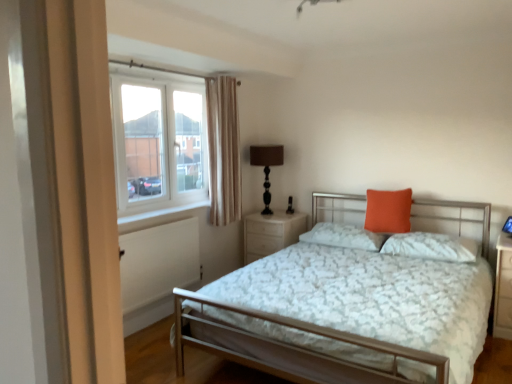
Describe the element at coordinates (162, 212) in the screenshot. The image size is (512, 384). I see `white painted wood at lower left` at that location.

Where is `white painted wood at lower left`? This screenshot has height=384, width=512. white painted wood at lower left is located at coordinates (162, 212).

Measure the distance between orange fabric pillow at center, the 1th pillow from the left, and camera.

orange fabric pillow at center, the 1th pillow from the left, is 11.26 feet away from camera.

Locate an element on the screen. orange matte pillow at upper right, which is the 2th pillow in left-to-right order is located at coordinates (388, 211).

Describe the element at coordinates (347, 313) in the screenshot. I see `metallic silver bed at center` at that location.

The width and height of the screenshot is (512, 384). I want to click on metallic silver bed at center, so click(347, 313).

This screenshot has height=384, width=512. What are the coordinates of `white textured pillow at center, which is counted as the first pillow, starting from the right` in the screenshot? It's located at (431, 246).

Locate an element on the screen. This screenshot has height=384, width=512. white painted wood at lower left is located at coordinates (162, 212).

How far apart are beige fabric curtain at upper left and orange fabric pillow at center, which appears as the third pillow when viewed from the right?

beige fabric curtain at upper left and orange fabric pillow at center, which appears as the third pillow when viewed from the right, are 3.70 feet apart.

Is beige fabric curtain at upper left taller than orange fabric pillow at center, the 1th pillow from the left?

Yes.

Is beige fabric curtain at upper left looking in the opposite direction of orange fabric pillow at center, the 1th pillow from the left?

That's not correct — beige fabric curtain at upper left is not looking away from orange fabric pillow at center, the 1th pillow from the left.

Is beige fabric curtain at upper left far from orange fabric pillow at center, which appears as the third pillow when viewed from the right?

That's right, there is a large distance between beige fabric curtain at upper left and orange fabric pillow at center, which appears as the third pillow when viewed from the right.

From a real-world perspective, is orange fabric pillow at center, the 1th pillow from the left, positioned under pine wood nightstand at center based on gravity?

No, from a real-world perspective, orange fabric pillow at center, the 1th pillow from the left, is not under pine wood nightstand at center.

Does orange fabric pillow at center, which appears as the third pillow when viewed from the right, turn towards pine wood nightstand at center?

No, orange fabric pillow at center, which appears as the third pillow when viewed from the right, does not turn towards pine wood nightstand at center.

Would you say orange fabric pillow at center, the 1th pillow from the left, is to the left or to the right of pine wood nightstand at center in the picture?

From the image, it's evident that orange fabric pillow at center, the 1th pillow from the left, is to the right of pine wood nightstand at center.

Relative to brown fabric-covered lamp at upper right, is white painted wood at lower left in front or behind?

white painted wood at lower left is in front of brown fabric-covered lamp at upper right.

From the image's perspective, which one is positioned higher, white painted wood at lower left or brown fabric-covered lamp at upper right?

brown fabric-covered lamp at upper right.

Which is farther, (170,212) or (253,155)?

The point (253,155) is farther.

Is white painted wood at lower left far from brown fabric-covered lamp at upper right?

That's not correct — white painted wood at lower left is a little close to brown fabric-covered lamp at upper right.

Between white textured pillow at center, marked as the 3th pillow in a left-to-right arrangement, and pine wood nightstand at center, which one appears on the right side from the viewer's perspective?

white textured pillow at center, marked as the 3th pillow in a left-to-right arrangement.

In terms of height, does white textured pillow at center, which is counted as the first pillow, starting from the right, look taller or shorter compared to pine wood nightstand at center?

Considering their sizes, white textured pillow at center, which is counted as the first pillow, starting from the right, has less height than pine wood nightstand at center.

At what (x,y) coordinates should I click in order to perform the action: click on the 1st pillow positioned above the pine wood nightstand at center (from the image's perspective). Please return your answer as a coordinate pair (x, y). This screenshot has height=384, width=512. Looking at the image, I should click on (431, 246).

From a real-world perspective, does white textured pillow at center, which is counted as the first pillow, starting from the right, sit lower than pine wood nightstand at center?

No, from a real-world perspective, white textured pillow at center, which is counted as the first pillow, starting from the right, is not under pine wood nightstand at center.

Is orange matte pillow at upper right, the second pillow when ordered from right to left, bigger than white textured pillow at center, which is counted as the first pillow, starting from the right?

No.

From the white textured pillow at center, which is counted as the first pillow, starting from the right, count 2nd pillows backward and point to it. Please provide its 2D coordinates.

[(388, 211)]

Is orange matte pillow at upper right, the second pillow when ordered from right to left, not close to white textured pillow at center, which is counted as the first pillow, starting from the right?

Actually, orange matte pillow at upper right, the second pillow when ordered from right to left, and white textured pillow at center, which is counted as the first pillow, starting from the right, are a little close together.

Is orange matte pillow at upper right, the second pillow when ordered from right to left, completely or partially outside of white textured pillow at center, marked as the 3th pillow in a left-to-right arrangement?

That's correct, orange matte pillow at upper right, the second pillow when ordered from right to left, is outside of white textured pillow at center, marked as the 3th pillow in a left-to-right arrangement.

Between orange matte pillow at upper right, which is the 2th pillow in left-to-right order, and clear glass window at upper left, which one appears on the right side from the viewer's perspective?

orange matte pillow at upper right, which is the 2th pillow in left-to-right order.

Does orange matte pillow at upper right, the second pillow when ordered from right to left, contain clear glass window at upper left?

No.

At what (x,y) coordinates should I click in order to perform the action: click on window above the orange matte pillow at upper right, which is the 2th pillow in left-to-right order (from the image's perspective). Please return your answer as a coordinate pair (x, y). Looking at the image, I should click on (158, 140).

Are orange matte pillow at upper right, which is the 2th pillow in left-to-right order, and clear glass window at upper left beside each other?

No, orange matte pillow at upper right, which is the 2th pillow in left-to-right order, is not touching clear glass window at upper left.

From the image's perspective, which is below, metallic silver bed at center or white painted wood at lower left?

metallic silver bed at center.

In the image, is metallic silver bed at center on the left side or the right side of white painted wood at lower left?

Clearly, metallic silver bed at center is on the right of white painted wood at lower left in the image.

Based on the photo, is white painted wood at lower left at the back of metallic silver bed at center?

No, metallic silver bed at center's orientation is not away from white painted wood at lower left.

Does metallic silver bed at center have a greater height compared to white painted wood at lower left?

Yes, metallic silver bed at center is taller than white painted wood at lower left.

Locate an element on the screen. The image size is (512, 384). curtain above the orange fabric pillow at center, the 1th pillow from the left (from a real-world perspective) is located at coordinates (223, 150).

You are a GUI agent. You are given a task and a screenshot of the screen. Output one action in this format:
    pyautogui.click(x=<x>, y=<y>)
    Task: Click on the nightstand below the orange fabric pillow at center, the 1th pillow from the left (from the image's perspective)
    
    Given the screenshot: What is the action you would take?
    pyautogui.click(x=271, y=233)

In the scene shown: From the image, which object appears to be farther from orange matte pillow at upper right, the second pillow when ordered from right to left, metallic silver bed at center or clear glass window at upper left?

Based on the image, clear glass window at upper left appears to be further to orange matte pillow at upper right, the second pillow when ordered from right to left.

Considering their positions, is orange matte pillow at upper right, which is the 2th pillow in left-to-right order, positioned further to pine wood nightstand at center than beige fabric curtain at upper left?

The object further to pine wood nightstand at center is orange matte pillow at upper right, which is the 2th pillow in left-to-right order.

When comparing their distances from white painted wood at lower left, does clear glass window at upper left or pine wood nightstand at center seem closer?

clear glass window at upper left.

From the image, which object appears to be nearer to beige fabric curtain at upper left, white textured pillow at center, marked as the 3th pillow in a left-to-right arrangement, or white painted wood at lower left?

white painted wood at lower left is closer to beige fabric curtain at upper left.

From the image, which object appears to be farther from white painted wood at lower left, white textured pillow at center, which is counted as the first pillow, starting from the right, or orange matte pillow at upper right, which is the 2th pillow in left-to-right order?

Among the two, white textured pillow at center, which is counted as the first pillow, starting from the right, is located further to white painted wood at lower left.

When comparing their distances from white textured pillow at center, which is counted as the first pillow, starting from the right, does orange matte pillow at upper right, which is the 2th pillow in left-to-right order, or metallic silver bed at center seem further?

Among the two, metallic silver bed at center is located further to white textured pillow at center, which is counted as the first pillow, starting from the right.

Estimate the real-world distances between objects in this image. Which object is closer to beige fabric curtain at upper left, metallic silver bed at center or orange matte pillow at upper right, which is the 2th pillow in left-to-right order?

orange matte pillow at upper right, which is the 2th pillow in left-to-right order, lies closer to beige fabric curtain at upper left than the other object.

Which object lies further to the anchor point white textured pillow at center, which is counted as the first pillow, starting from the right, white painted wood at lower left or orange fabric pillow at center, the 1th pillow from the left?

Among the two, white painted wood at lower left is located further to white textured pillow at center, which is counted as the first pillow, starting from the right.

Where is `window between white painted wood at lower left and beige fabric curtain at upper left from front to back`? The image size is (512, 384). window between white painted wood at lower left and beige fabric curtain at upper left from front to back is located at coordinates (158, 140).

Find the location of a particular element. This screenshot has height=384, width=512. pillow located between brown fabric-covered lamp at upper right and orange matte pillow at upper right, which is the 2th pillow in left-to-right order, in the left-right direction is located at coordinates (344, 236).

This screenshot has height=384, width=512. I want to click on nightstand between clear glass window at upper left and orange matte pillow at upper right, which is the 2th pillow in left-to-right order, in the horizontal direction, so click(271, 233).

What are the coordinates of `nightstand between clear glass window at upper left and white textured pillow at center, marked as the 3th pillow in a left-to-right arrangement` in the screenshot? It's located at (271, 233).